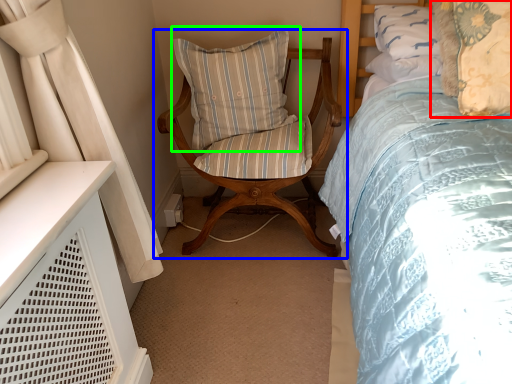
Question: Which object is positioned closest to pillow (highlighted by a red box)? Select from chair (highlighted by a blue box) and pillow (highlighted by a green box).

Choices:
 (A) chair
 (B) pillow

Answer: (A)